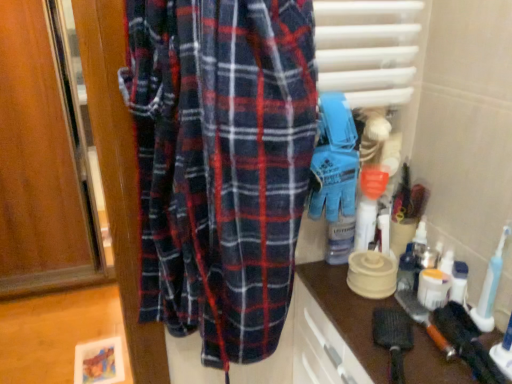
Question: Is point (415, 352) positioned closer to the camera than point (344, 117)?

Choices:
 (A) farther
 (B) closer

Answer: (B)

Question: Which is correct: brown matte countertop at lower right is inside blue rubber gloves at center, or outside of it?

Choices:
 (A) inside
 (B) outside

Answer: (B)

Question: Estimate the real-world distances between objects in this image. Which object is farther from the blue rubber gloves at center?

Choices:
 (A) brown matte countertop at lower right
 (B) black rubber toothbrush at lower right

Answer: (B)

Question: Considering the real-world distances, which object is closest to the brown matte countertop at lower right?

Choices:
 (A) blue rubber gloves at center
 (B) black rubber toothbrush at lower right

Answer: (B)